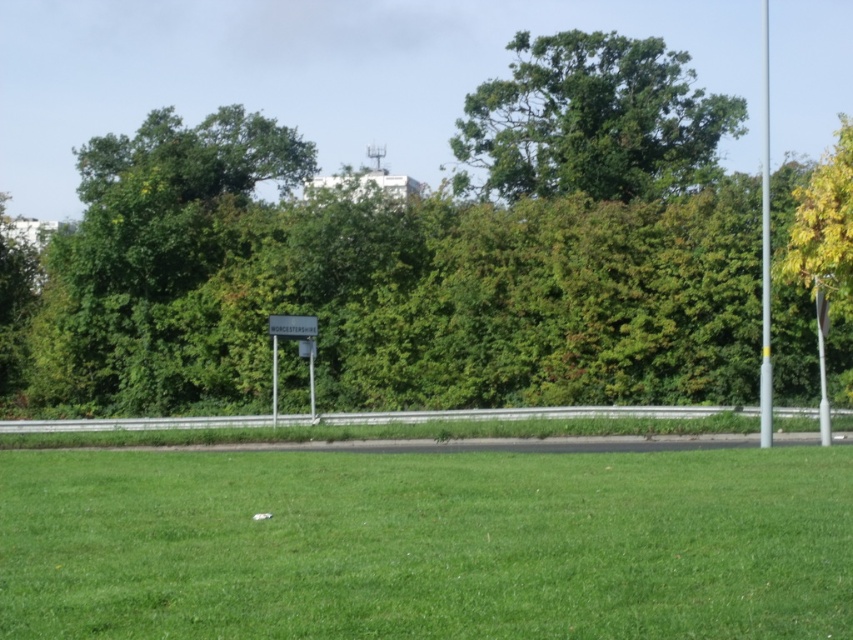
Question: Among these points, which one is farthest from the camera?

Choices:
 (A) (0, 259)
 (B) (646, 140)

Answer: (B)

Question: Is silver metallic pole at right closer to camera compared to white plastic sign at center?

Choices:
 (A) no
 (B) yes

Answer: (B)

Question: Can you confirm if green leafy tree at center is positioned below white plastic sign at center?

Choices:
 (A) yes
 (B) no

Answer: (B)

Question: Is silver metallic pole at right thinner than white plastic sign at center?

Choices:
 (A) yes
 (B) no

Answer: (B)

Question: Which of these objects is positioned closest to the green leafy tree at center?

Choices:
 (A) silver metallic pole at right
 (B) green grass at center
 (C) green leafy tree at upper center

Answer: (C)

Question: Which point appears closest to the camera in this image?

Choices:
 (A) (273, 413)
 (B) (381, 532)
 (C) (759, 371)
 (D) (689, 164)

Answer: (B)